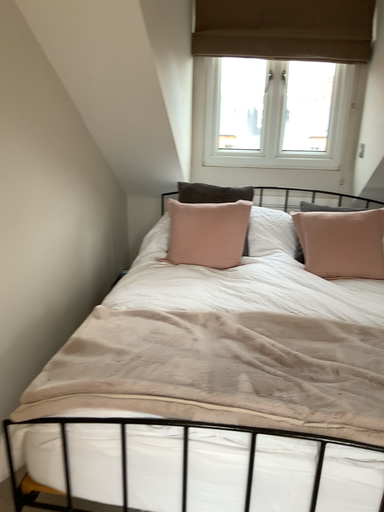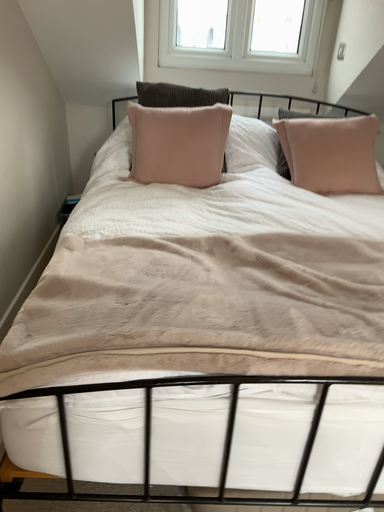
Question: Which way did the camera rotate in the video?

Choices:
 (A) rotated downward
 (B) rotated upward

Answer: (A)